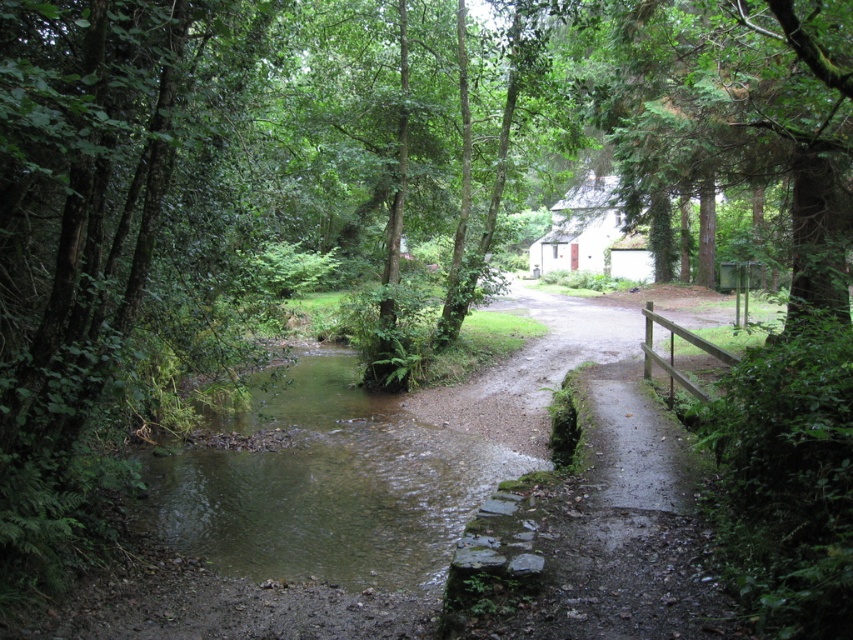
You are standing at the point marked as point (294, 376) in the image. If you want to walk back to the starting point where you first entered the scene, which direction should you go?

Since you are at point (294, 376), which is 23.05 meters away from the viewer, you should walk towards the viewer to return to the starting point.

You are standing at the point marked by the coordinates point (329,484) in the image. What is the closest object to you?

The closest object to you at point (329,484) is the green mossy stream at center, as the coordinates mark its location.

Consider the image. You are a hiker who wants to cross the stream. You see the green mossy stream at center and the green leafy tree at upper right. Which object is closer to the ground?

The green mossy stream at center is below green leafy tree at upper right, so the green mossy stream at center is closer to the ground.